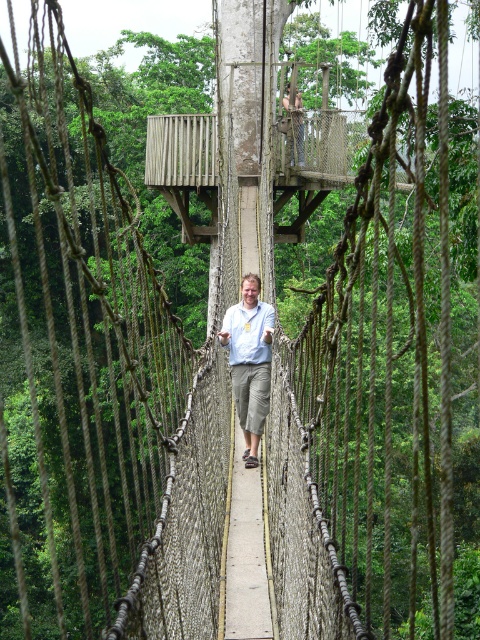
Between wooden platform at upper center and matte blue shirt at center, which one is positioned lower?

matte blue shirt at center

Does wooden platform at upper center appear on the left side of matte blue shirt at center?

Incorrect, wooden platform at upper center is not on the left side of matte blue shirt at center.

What do you see at coordinates (183, 164) in the screenshot? The width and height of the screenshot is (480, 640). I see `wooden platform at upper center` at bounding box center [183, 164].

Find the location of a particular element. wooden platform at upper center is located at coordinates (183, 164).

Does point (254, 358) come closer to viewer compared to point (298, 131)?

Yes, it is in front of point (298, 131).

Describe the element at coordinates (250, 360) in the screenshot. Image resolution: width=480 pixels, height=640 pixels. I see `matte blue shirt at center` at that location.

Is point (242, 396) positioned before point (301, 141)?

Yes.

Locate an element on the screen. The width and height of the screenshot is (480, 640). matte blue shirt at center is located at coordinates (250, 360).

Can you confirm if wooden platform at upper center is positioned to the right of matte gray pants at center?

Correct, you'll find wooden platform at upper center to the right of matte gray pants at center.

Does wooden platform at upper center have a lesser height compared to matte gray pants at center?

No, wooden platform at upper center is not shorter than matte gray pants at center.

Is point (283, 236) positioned behind point (288, 106)?

Yes, it is behind point (288, 106).

Locate an element on the screen. This screenshot has height=640, width=480. wooden platform at upper center is located at coordinates (183, 164).